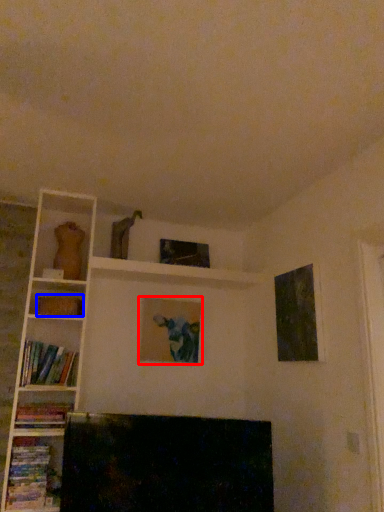
Question: Which of the following is the farthest to the observer, picture frame (highlighted by a red box) or paperback book (highlighted by a blue box)?

Choices:
 (A) picture frame
 (B) paperback book

Answer: (A)